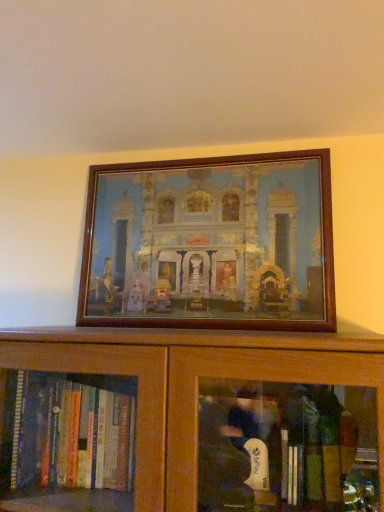
What do you see at coordinates (210, 244) in the screenshot? I see `wooden picture frame at upper center` at bounding box center [210, 244].

Locate an element on the screen. Image resolution: width=384 pixels, height=512 pixels. wooden picture frame at upper center is located at coordinates (210, 244).

Looking at this image, in order to face wooden picture frame at upper center, should I rotate leftwards or rightwards?

It's best to rotate right around 0.872 degrees.

In order to click on wooden picture frame at upper center in this screenshot , I will do `click(210, 244)`.